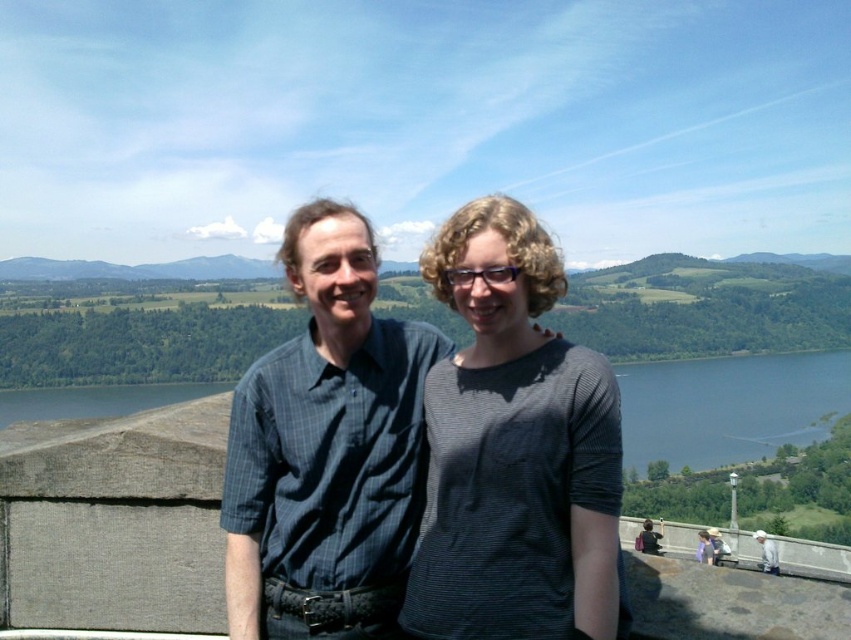
Question: Is dark blue striped shirt at center wider than blue water at lower left?

Choices:
 (A) yes
 (B) no

Answer: (B)

Question: Which of the following is the farthest from the observer?

Choices:
 (A) (96, 397)
 (B) (684, 376)
 (C) (572, 566)
 (D) (397, 388)

Answer: (B)

Question: Is dark blue striped shirt at center to the left of blue water at lower right from the viewer's perspective?

Choices:
 (A) no
 (B) yes

Answer: (B)

Question: Which of these objects is positioned closest to the blue water at lower right?

Choices:
 (A) dark blue striped shirt at center
 (B) dark gray striped shirt at center
 (C) blue water at lower left

Answer: (C)

Question: Which object is closer to the camera taking this photo?

Choices:
 (A) blue water at lower left
 (B) dark blue striped shirt at center

Answer: (B)

Question: Does dark blue striped shirt at center have a greater width compared to blue water at lower left?

Choices:
 (A) no
 (B) yes

Answer: (A)